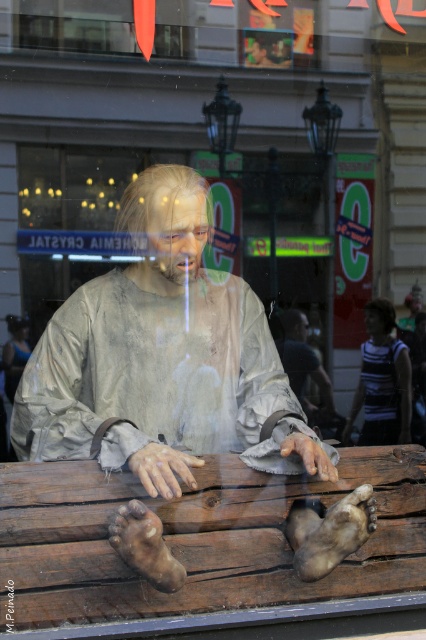
You are a customer entering the store and see the brown wooden bench at lower center and the striped fabric shirt at center. Which object is closer to you as you approach the store entrance?

The brown wooden bench at lower center is closer to you because it is in front of the striped fabric shirt at center.

You are standing outside a shop window and notice a point marked at coordinates (221, 353) on the window. If you want to touch this point with a stick that is 2 meters long, will you be able to reach it?

The point at (221, 353) is 2.59 meters away from you. Since your stick is only 2 meters long, you cannot reach it.

You are a customer entering the store and see the matte gray mannequin at center and the brown wooden bench at lower center. Which object is closer to the entrance?

The brown wooden bench at lower center is closer to the entrance because it is positioned to the right of the matte gray mannequin at center, which is typically where entrances are located in such setups.